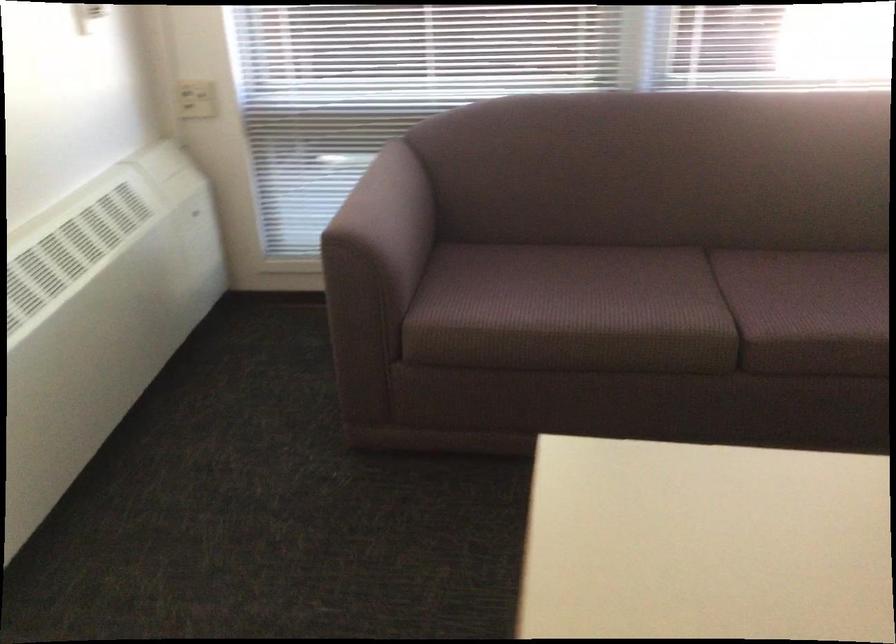
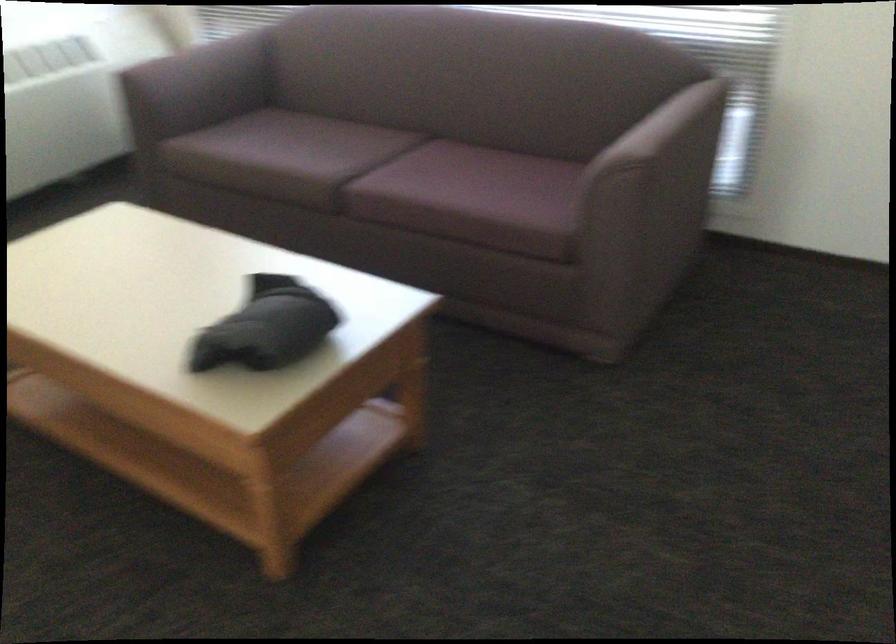
Question: The images are taken continuously from a first-person perspective. In which direction are you moving?

Choices:
 (A) Left
 (B) Right
 (C) Forward
 (D) Backward

Answer: (B)